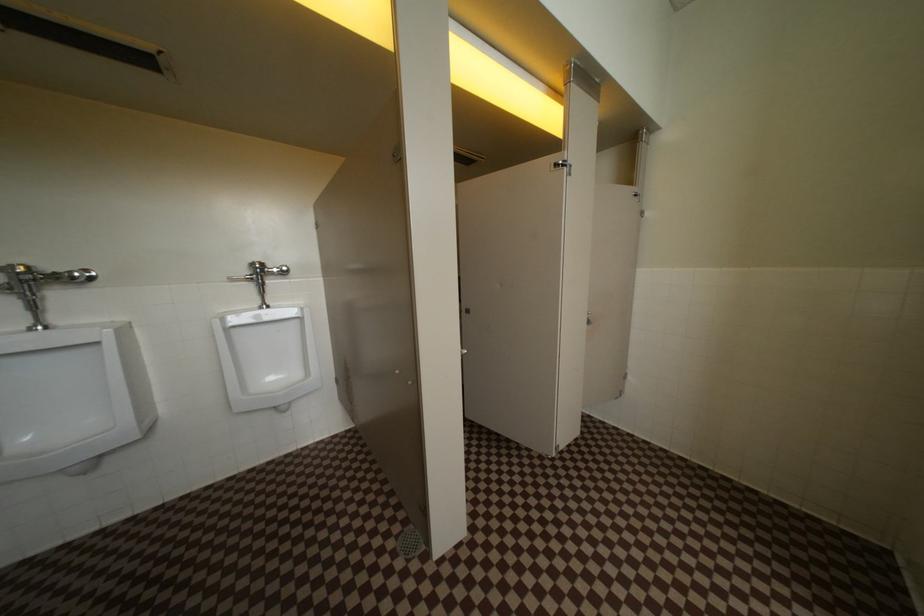
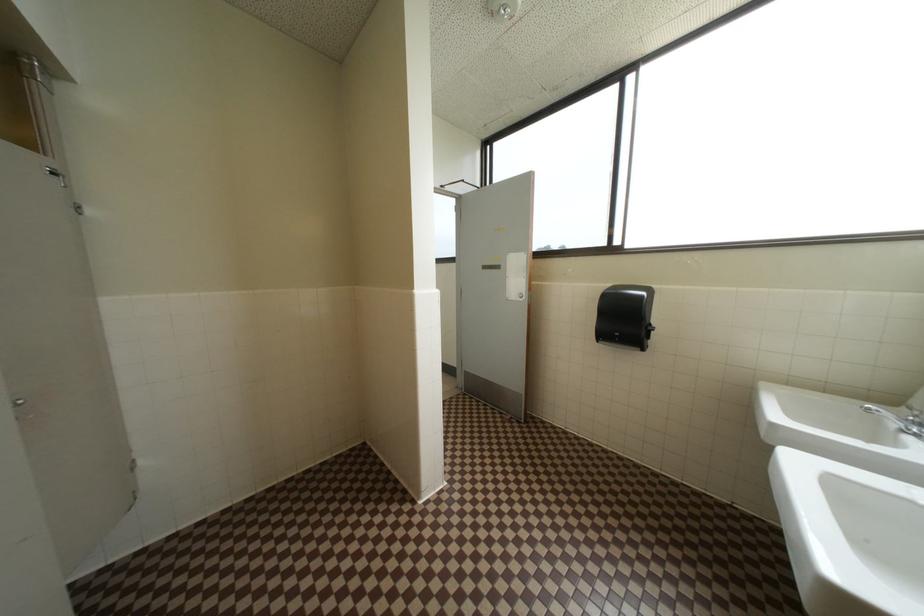
Question: The camera is either moving clockwise (left) or counter-clockwise (right) around the object. The first image is from the beginning of the video and the second image is from the end. Is the camera moving left or right when shooting the video?

Choices:
 (A) Left
 (B) Right

Answer: (A)